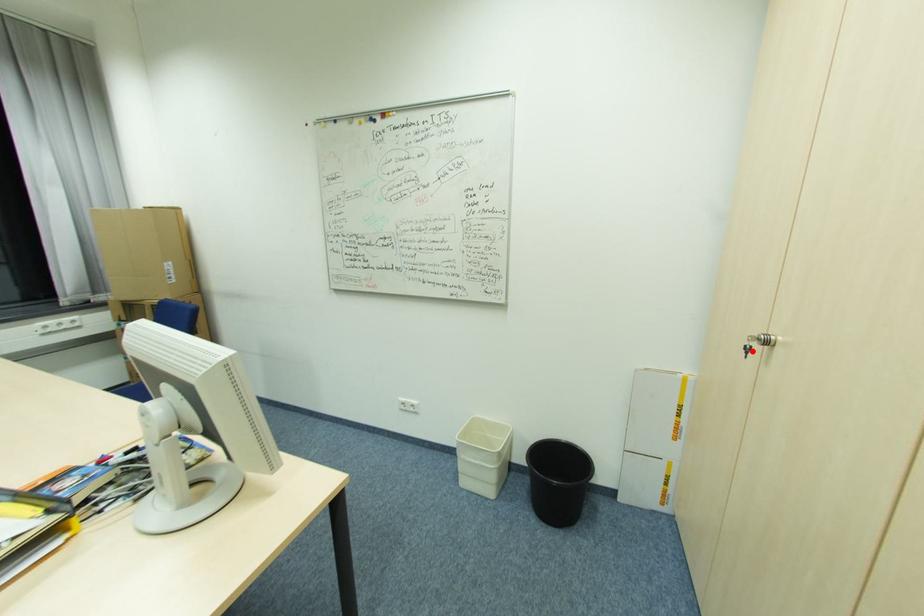
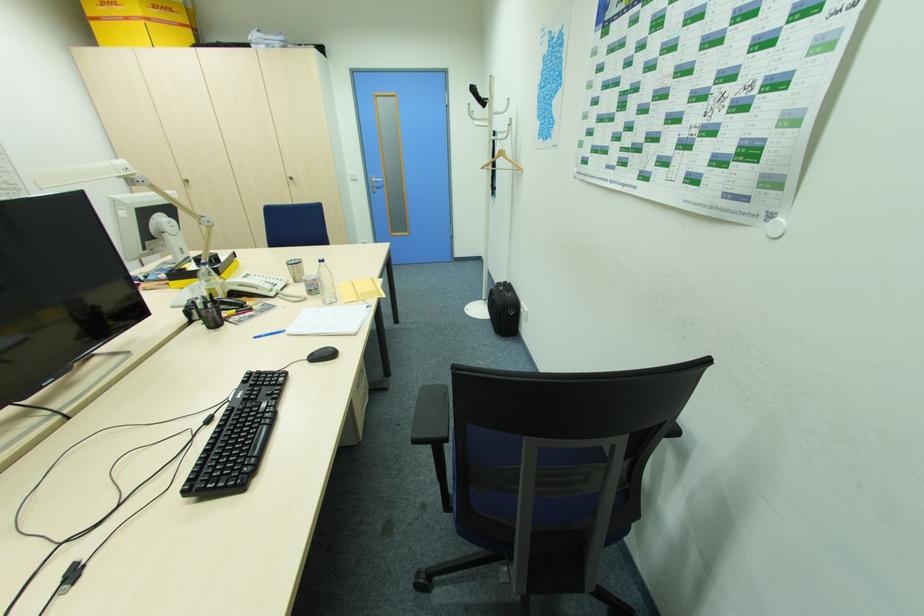
In the second image, find the point that corresponds to the highlighted location in the first image.

(188, 185)